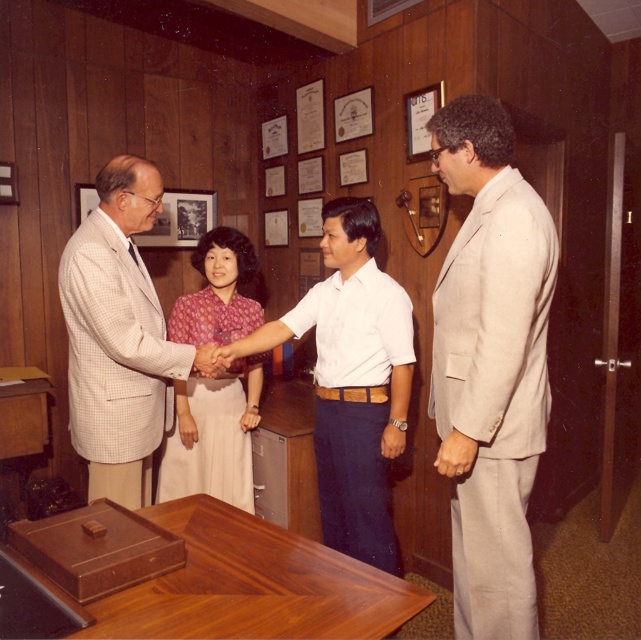
Question: Which point is closer to the camera?

Choices:
 (A) (483, 225)
 (B) (117, 173)
 (C) (370, 328)

Answer: (A)

Question: Which of these objects is positioned closest to the matte skin hand at center?

Choices:
 (A) matte pink blouse at center
 (B) beige suit at right

Answer: (A)

Question: Does light beige checkered suit at left appear on the left side of matte pink blouse at center?

Choices:
 (A) yes
 (B) no

Answer: (A)

Question: Can you confirm if matte pink blouse at center is wider than matte skin hand at center?

Choices:
 (A) no
 (B) yes

Answer: (B)

Question: Does beige suit at right appear under white cotton shirt at center?

Choices:
 (A) no
 (B) yes

Answer: (A)

Question: Among these objects, which one is nearest to the camera?

Choices:
 (A) light beige checkered suit at left
 (B) beige suit at right

Answer: (B)